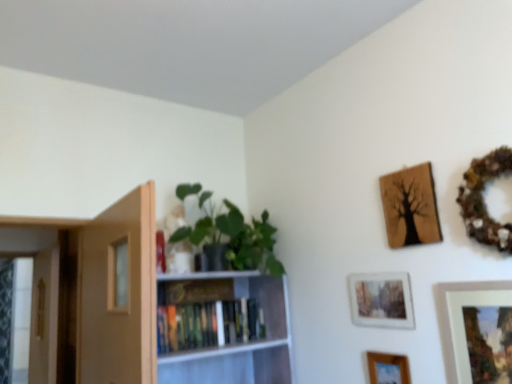
This screenshot has height=384, width=512. What do you see at coordinates (238, 342) in the screenshot?
I see `white glossy bookshelf at center` at bounding box center [238, 342].

In order to click on light brown wood door at left in this screenshot , I will do `click(118, 293)`.

This screenshot has width=512, height=384. What do you see at coordinates (118, 293) in the screenshot?
I see `light brown wood door at left` at bounding box center [118, 293].

The width and height of the screenshot is (512, 384). What do you see at coordinates (388, 368) in the screenshot? I see `wooden picture frame at lower center, which ranks as the fourth picture frame in top-to-bottom order` at bounding box center [388, 368].

What do you see at coordinates (410, 207) in the screenshot? I see `wooden textured picture frame at upper right, the 1th picture frame when ordered from top to bottom` at bounding box center [410, 207].

Find the location of a particular element. white glossy bookshelf at center is located at coordinates coord(238,342).

Does matte wooden picture frame at center, the third picture frame when ordered from bottom to top, lie behind wooden textured picture frame at upper right, the 1th picture frame when ordered from top to bottom?

Yes, matte wooden picture frame at center, the third picture frame when ordered from bottom to top, is further from the viewer.

From a real-world perspective, is matte wooden picture frame at center, the 2th picture frame when ordered from top to bottom, on top of wooden textured picture frame at upper right, the 1th picture frame when ordered from top to bottom?

Incorrect, from a real-world perspective, matte wooden picture frame at center, the 2th picture frame when ordered from top to bottom, is lower than wooden textured picture frame at upper right, the 1th picture frame when ordered from top to bottom.

Based on the photo, what's the angular difference between matte wooden picture frame at center, the 2th picture frame when ordered from top to bottom, and wooden textured picture frame at upper right, positioned as the fourth picture frame in bottom-to-top order,'s facing directions?

The angle between the facing direction of matte wooden picture frame at center, the 2th picture frame when ordered from top to bottom, and the facing direction of wooden textured picture frame at upper right, positioned as the fourth picture frame in bottom-to-top order, is 0.0109 degrees.

Consider the image. From the image's perspective, which one is positioned lower, matte wooden picture frame at center, the third picture frame when ordered from bottom to top, or wooden textured picture frame at upper right, positioned as the fourth picture frame in bottom-to-top order?

From the image's view, matte wooden picture frame at center, the third picture frame when ordered from bottom to top, is below.

Based on the photo, are matte wooden picture frame at center, the third picture frame when ordered from bottom to top, and light brown wood door at left making contact?

matte wooden picture frame at center, the third picture frame when ordered from bottom to top, and light brown wood door at left are clearly separated.

The height and width of the screenshot is (384, 512). I want to click on door positioned vertically above the matte wooden picture frame at center, the third picture frame when ordered from bottom to top (from a real-world perspective), so click(118, 293).

Looking at this image, is matte wooden picture frame at center, the 2th picture frame when ordered from top to bottom, at the left side of light brown wood door at left?

Incorrect, matte wooden picture frame at center, the 2th picture frame when ordered from top to bottom, is not on the left side of light brown wood door at left.

Between matte wooden picture frame at center, the 2th picture frame when ordered from top to bottom, and light brown wood door at left, which one has smaller width?

matte wooden picture frame at center, the 2th picture frame when ordered from top to bottom.

Is matte white picture frame at lower right, the 2th picture frame ordered from the bottom, oriented away from matte wooden picture frame at center, the 2th picture frame when ordered from top to bottom?

No, matte white picture frame at lower right, the 2th picture frame ordered from the bottom,'s orientation is not away from matte wooden picture frame at center, the 2th picture frame when ordered from top to bottom.

Considering the relative sizes of matte white picture frame at lower right, the 2th picture frame ordered from the bottom, and matte wooden picture frame at center, the third picture frame when ordered from bottom to top, in the image provided, is matte white picture frame at lower right, the 2th picture frame ordered from the bottom, wider than matte wooden picture frame at center, the third picture frame when ordered from bottom to top,?

Correct, the width of matte white picture frame at lower right, the 2th picture frame ordered from the bottom, exceeds that of matte wooden picture frame at center, the third picture frame when ordered from bottom to top.

In terms of size, does matte white picture frame at lower right, the 2th picture frame ordered from the bottom, appear bigger or smaller than matte wooden picture frame at center, the third picture frame when ordered from bottom to top?

Considering their sizes, matte white picture frame at lower right, the 2th picture frame ordered from the bottom, takes up more space than matte wooden picture frame at center, the third picture frame when ordered from bottom to top.

Is the position of matte white picture frame at lower right, the 2th picture frame ordered from the bottom, less distant than that of matte wooden picture frame at center, the 2th picture frame when ordered from top to bottom?

Yes, matte white picture frame at lower right, the 2th picture frame ordered from the bottom, is in front of matte wooden picture frame at center, the 2th picture frame when ordered from top to bottom.

Considering the relative sizes of matte wooden picture frame at center, the 2th picture frame when ordered from top to bottom, and wooden picture frame at lower center, which ranks as the fourth picture frame in top-to-bottom order, in the image provided, is matte wooden picture frame at center, the 2th picture frame when ordered from top to bottom, wider than wooden picture frame at lower center, which ranks as the fourth picture frame in top-to-bottom order,?

No, matte wooden picture frame at center, the 2th picture frame when ordered from top to bottom, is not wider than wooden picture frame at lower center, which ranks as the fourth picture frame in top-to-bottom order.

From the image's perspective, which picture frame is the 2nd one above the wooden picture frame at lower center, which ranks as the fourth picture frame in top-to-bottom order? Please provide its 2D coordinates.

[(381, 300)]

Does matte wooden picture frame at center, the third picture frame when ordered from bottom to top, touch wooden picture frame at lower center, which is the first picture frame from bottom to top?

No, matte wooden picture frame at center, the third picture frame when ordered from bottom to top, is not with wooden picture frame at lower center, which is the first picture frame from bottom to top.

Find the location of `houseplant behind the wooden picture frame at lower center, which ranks as the fourth picture frame in top-to-bottom order`. houseplant behind the wooden picture frame at lower center, which ranks as the fourth picture frame in top-to-bottom order is located at coordinates (231, 234).

Would you say green matte plant at upper left is part of wooden picture frame at lower center, which ranks as the fourth picture frame in top-to-bottom order,'s contents?

No, green matte plant at upper left is not surrounded by wooden picture frame at lower center, which ranks as the fourth picture frame in top-to-bottom order.

Does wooden picture frame at lower center, which is the first picture frame from bottom to top, touch green matte plant at upper left?

No, wooden picture frame at lower center, which is the first picture frame from bottom to top, is not next to green matte plant at upper left.

From a real-world perspective, which object stands above the other?

wooden textured picture frame at upper right, the 1th picture frame when ordered from top to bottom.

Is wooden textured picture frame at upper right, positioned as the fourth picture frame in bottom-to-top order, a part of matte white picture frame at lower right, the 2th picture frame ordered from the bottom?

No, wooden textured picture frame at upper right, positioned as the fourth picture frame in bottom-to-top order, is not surrounded by matte white picture frame at lower right, the 2th picture frame ordered from the bottom.

Does point (493, 376) lie in front of point (430, 179)?

Yes, point (493, 376) is in front of point (430, 179).

Which of these two, matte white picture frame at lower right, which is counted as the 3th picture frame, starting from the top, or wooden textured picture frame at upper right, positioned as the fourth picture frame in bottom-to-top order, is wider?

With larger width is matte white picture frame at lower right, which is counted as the 3th picture frame, starting from the top.

Is white glossy bookshelf at center wider or thinner than matte wooden picture frame at center, the 2th picture frame when ordered from top to bottom?

Considering their sizes, white glossy bookshelf at center looks broader than matte wooden picture frame at center, the 2th picture frame when ordered from top to bottom.

Does white glossy bookshelf at center contain matte wooden picture frame at center, the third picture frame when ordered from bottom to top?

Definitely not — matte wooden picture frame at center, the third picture frame when ordered from bottom to top, is not inside white glossy bookshelf at center.

Would you say white glossy bookshelf at center is a long distance from matte wooden picture frame at center, the third picture frame when ordered from bottom to top?

No.

Locate an element on the screen. This screenshot has width=512, height=384. the 1st picture frame positioned above the white glossy bookshelf at center (from a real-world perspective) is located at coordinates (381, 300).

Which picture frame is the 2nd one when counting from the back of the wooden textured picture frame at upper right, positioned as the fourth picture frame in bottom-to-top order? Please provide its 2D coordinates.

[(381, 300)]

Locate an element on the screen. The image size is (512, 384). door in front of the matte wooden picture frame at center, the third picture frame when ordered from bottom to top is located at coordinates (118, 293).

In the scene shown: Estimate the real-world distances between objects in this image. Which object is closer to white glossy bookshelf at center, hardcover books at center or wooden textured picture frame at upper right, positioned as the fourth picture frame in bottom-to-top order?

hardcover books at center.

Considering their positions, is wooden textured picture frame at upper right, positioned as the fourth picture frame in bottom-to-top order, positioned further to light brown wood door at left than white glossy bookshelf at center?

wooden textured picture frame at upper right, positioned as the fourth picture frame in bottom-to-top order, is positioned further to the anchor light brown wood door at left.

In the scene shown: Which object lies nearer to the anchor point white glossy bookshelf at center, hardcover books at center or green matte plant at upper left?

hardcover books at center lies closer to white glossy bookshelf at center than the other object.

Which object lies further to the anchor point light brown wood door at left, white glossy bookshelf at center or matte wooden picture frame at center, the 2th picture frame when ordered from top to bottom?

matte wooden picture frame at center, the 2th picture frame when ordered from top to bottom.

From the image, which object appears to be nearer to matte white picture frame at lower right, which is counted as the 3th picture frame, starting from the top, light brown wood door at left or wooden textured picture frame at upper right, positioned as the fourth picture frame in bottom-to-top order?

wooden textured picture frame at upper right, positioned as the fourth picture frame in bottom-to-top order, is closer to matte white picture frame at lower right, which is counted as the 3th picture frame, starting from the top.

Which object lies nearer to the anchor point wooden picture frame at lower center, which is the first picture frame from bottom to top, hardcover books at center or matte wooden picture frame at center, the third picture frame when ordered from bottom to top?

matte wooden picture frame at center, the third picture frame when ordered from bottom to top.

From the picture: Estimate the real-world distances between objects in this image. Which object is closer to white glossy bookshelf at center, matte white picture frame at lower right, which is counted as the 3th picture frame, starting from the top, or wooden textured picture frame at upper right, positioned as the fourth picture frame in bottom-to-top order?

wooden textured picture frame at upper right, positioned as the fourth picture frame in bottom-to-top order.

Looking at the image, which one is located closer to matte wooden picture frame at center, the 2th picture frame when ordered from top to bottom, hardcover books at center or light brown wood door at left?

hardcover books at center is positioned closer to the anchor matte wooden picture frame at center, the 2th picture frame when ordered from top to bottom.

Locate an element on the screen. This screenshot has height=384, width=512. book between light brown wood door at left and matte white picture frame at lower right, the 2th picture frame ordered from the bottom, from left to right is located at coordinates (198, 325).

Locate an element on the screen. picture frame that lies between wooden textured picture frame at upper right, the 1th picture frame when ordered from top to bottom, and matte white picture frame at lower right, which is counted as the 3th picture frame, starting from the top, from top to bottom is located at coordinates (381, 300).

The width and height of the screenshot is (512, 384). Identify the location of book that lies between green matte plant at upper left and white glossy bookshelf at center from top to bottom. (198, 325).

The height and width of the screenshot is (384, 512). I want to click on houseplant between white glossy bookshelf at center and wooden picture frame at lower center, which ranks as the fourth picture frame in top-to-bottom order, from left to right, so click(x=231, y=234).